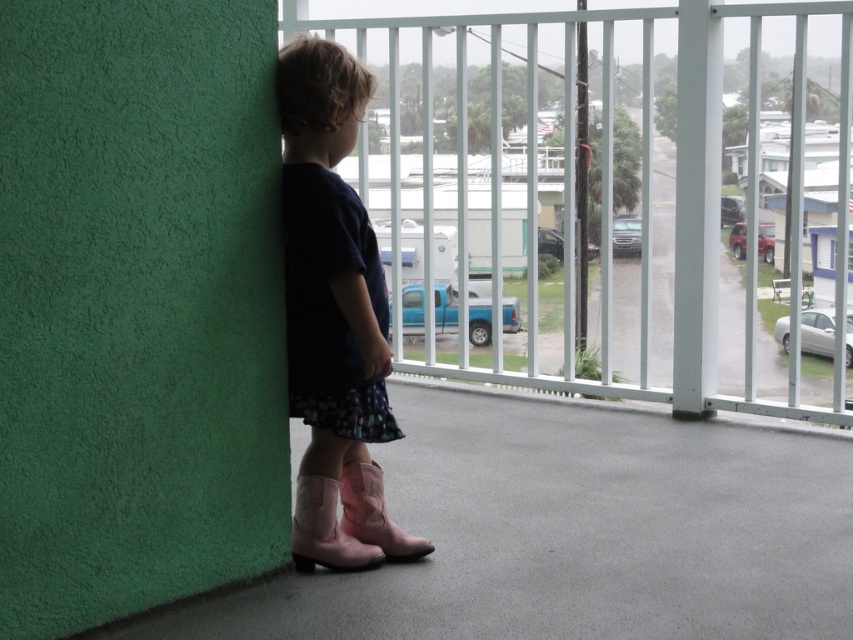
You are standing on the balcony and want to place a small potted plant between the white metal railing at upper center and the pink suede boots at lower left. Which object should the plant be closer to if it needs to be placed closer to the viewer?

The plant should be placed closer to the white metal railing at upper center because it is further to the viewer than the pink suede boots at lower left, so positioning it near the railing would place it closer to you.

You are a parent checking the safety of the balcony where your child is standing. The child is wearing the pink suede boot at lower center. Based on the scene description, can you confirm if the white metal railing at upper center is tall enough to prevent the child from climbing over it?

The white metal railing at upper center has a greater height compared to the pink suede boot at lower center. Since the railing is taller than the boot, it is likely tall enough to prevent the child from climbing over it, provided the child cannot reach higher than the boot height.

You are a delivery drone trying to land on the balcony. The landing zone must be clear of obstacles. Is the point at coordinates point (643, 189) on the balcony free of obstructions?

The white metal railing at upper center is located at point (643, 189), so the point is occupied by the railing and not free of obstructions.